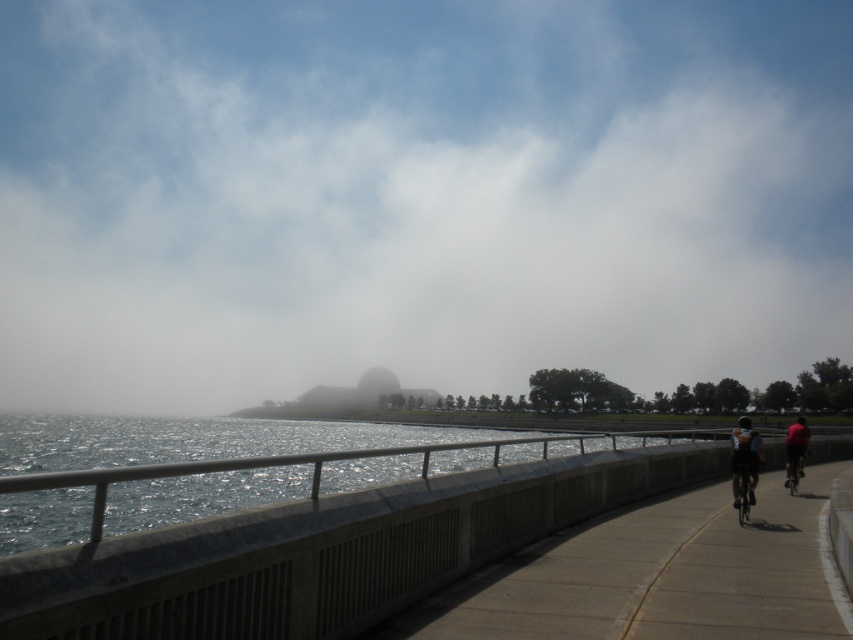
You are standing at the paved pathway and want to take a photo of the dome shaped structure in the background. However, there is an object blocking your view at point [416,196]. What is the object blocking your view?

The foggy atmosphere at upper center is located at point [416,196], so the object blocking your view is the foggy atmosphere at upper center.